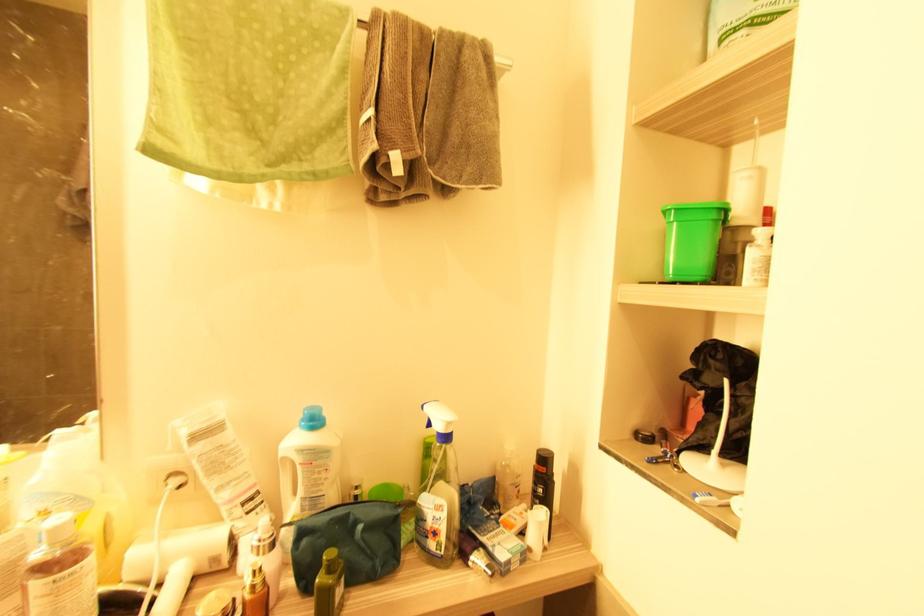
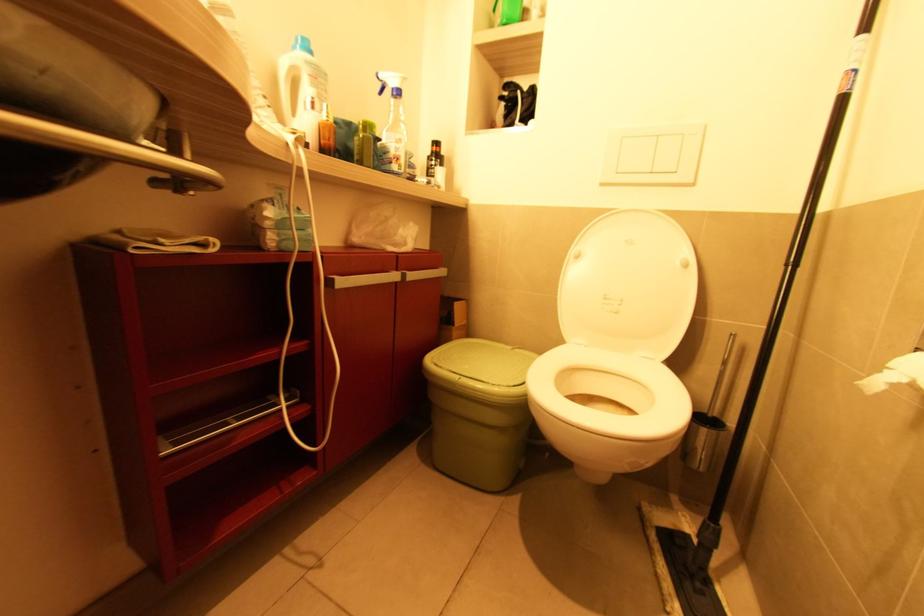
Question: How did the camera likely rotate?

Choices:
 (A) Left
 (B) Right
 (C) Up
 (D) Down

Answer: (B)